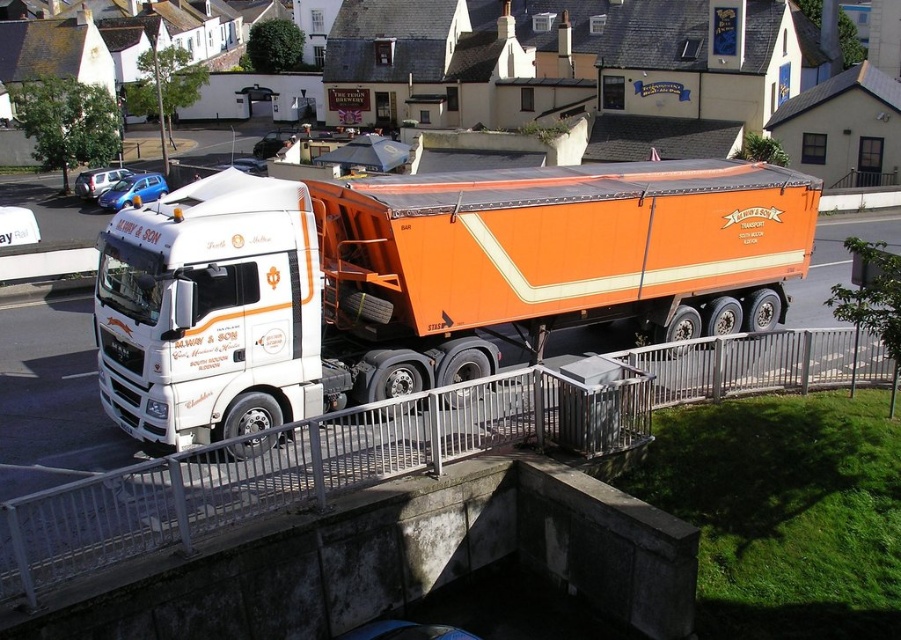
Question: Is orange matte trailer truck at center in front of white metal rail at center?

Choices:
 (A) yes
 (B) no

Answer: (B)

Question: In this image, where is orange matte trailer truck at center located relative to white metal rail at center?

Choices:
 (A) above
 (B) below

Answer: (A)

Question: Can you confirm if orange matte trailer truck at center is smaller than white metal rail at center?

Choices:
 (A) no
 (B) yes

Answer: (A)

Question: Which object is farther from the camera taking this photo?

Choices:
 (A) orange matte trailer truck at center
 (B) white metal rail at center

Answer: (A)